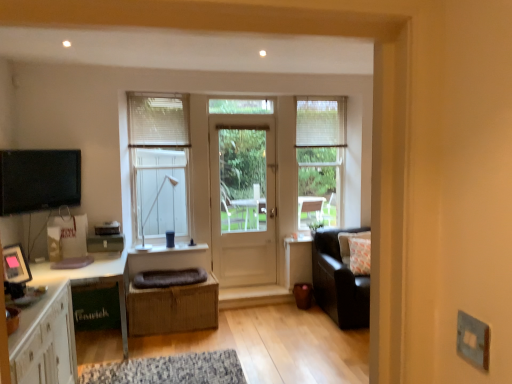
The width and height of the screenshot is (512, 384). I want to click on white textured blinds at upper right, acting as the first window starting from the right, so click(x=320, y=159).

The width and height of the screenshot is (512, 384). Describe the element at coordinates (173, 308) in the screenshot. I see `brown woven crate at center` at that location.

Describe the element at coordinates (152, 209) in the screenshot. I see `matte white lamp at upper center` at that location.

Identify the location of white wooden door at center. (243, 198).

Find the location of a particular element. clear glass door at center, arranged as the second window when viewed from the right is located at coordinates (241, 106).

In the image, is matte white lamp at upper center on the left side or the right side of white glossy cabinet at lower left?

Clearly, matte white lamp at upper center is on the right of white glossy cabinet at lower left in the image.

From the image's perspective, is matte white lamp at upper center located above white glossy cabinet at lower left?

Yes, from the image's perspective, matte white lamp at upper center is above white glossy cabinet at lower left.

Considering the sizes of objects matte white lamp at upper center and white glossy cabinet at lower left in the image provided, who is shorter, matte white lamp at upper center or white glossy cabinet at lower left?

matte white lamp at upper center.

Consider the image. Can we say matte white lamp at upper center lies outside white glossy cabinet at lower left?

matte white lamp at upper center lies outside white glossy cabinet at lower left's area.

Are white textured blinds at upper right, which is counted as the third window, starting from the left, and matte white lamp at upper center located far from each other?

That's right, there is a large distance between white textured blinds at upper right, which is counted as the third window, starting from the left, and matte white lamp at upper center.

Considering the positions of objects white textured blinds at upper right, acting as the first window starting from the right, and matte white lamp at upper center in the image provided, who is more to the left, white textured blinds at upper right, acting as the first window starting from the right, or matte white lamp at upper center?

From the viewer's perspective, matte white lamp at upper center appears more on the left side.

Is the depth of white textured blinds at upper right, which is counted as the third window, starting from the left, less than that of matte white lamp at upper center?

No.

From the image's perspective, between white textured blinds at upper right, acting as the first window starting from the right, and matte white lamp at upper center, who is located below?

matte white lamp at upper center.

Choose the correct answer: Is white fabric curtain at upper left, which appears as the first curtain when viewed from the front, inside matte white window at center left, acting as the 3th window starting from the right, or outside it?

white fabric curtain at upper left, which appears as the first curtain when viewed from the front, is inside matte white window at center left, acting as the 3th window starting from the right.

Is white fabric curtain at upper left, placed as the first curtain when sorted from left to right, oriented towards matte white window at center left, the 1th window viewed from the left?

Yes.

You are a GUI agent. You are given a task and a screenshot of the screen. Output one action in this format:
    pyautogui.click(x=<x>, y=<y>)
    Task: Click on the 1st curtain above when counting from the matte white window at center left, acting as the 3th window starting from the right (from the image's perspective)
    This screenshot has height=384, width=512.
    Given the screenshot: What is the action you would take?
    pyautogui.click(x=158, y=121)

Between white fabric curtain at upper left, the second curtain when ordered from back to front, and matte white window at center left, acting as the 3th window starting from the right, which one has smaller size?

With smaller size is white fabric curtain at upper left, the second curtain when ordered from back to front.

Is white fabric curtain at upper center, the 1th curtain viewed from the back, bigger than brown woven crate at center?

No, white fabric curtain at upper center, the 1th curtain viewed from the back, is not bigger than brown woven crate at center.

Can you confirm if white fabric curtain at upper center, the 1th curtain viewed from the back, is positioned to the right of brown woven crate at center?

Yes, white fabric curtain at upper center, the 1th curtain viewed from the back, is to the right of brown woven crate at center.

What's the angular difference between white fabric curtain at upper center, the 1th curtain viewed from the back, and brown woven crate at center's facing directions?

2.26 degrees.

Find the location of `crate in front of the white fabric curtain at upper center, which is the 2th curtain from front to back`. crate in front of the white fabric curtain at upper center, which is the 2th curtain from front to back is located at coordinates (173, 308).

Who is bigger, matte white window at center left, acting as the 3th window starting from the right, or white glossy cabinet at lower left?

→ white glossy cabinet at lower left is bigger.

Is matte white window at center left, acting as the 3th window starting from the right, not inside white glossy cabinet at lower left?

Absolutely, matte white window at center left, acting as the 3th window starting from the right, is external to white glossy cabinet at lower left.

From a real-world perspective, relative to white glossy cabinet at lower left, is matte white window at center left, acting as the 3th window starting from the right, vertically above or below?

In terms of real-world spatial position, matte white window at center left, acting as the 3th window starting from the right, is above white glossy cabinet at lower left.

From a real-world perspective, who is located higher, brown woven crate at center or white paper bag at left?

In real-world perspective, white paper bag at left is above.

Can you confirm if brown woven crate at center is taller than white paper bag at left?

→ No, brown woven crate at center is not taller than white paper bag at left.

Does brown woven crate at center have a lesser width compared to white paper bag at left?

In fact, brown woven crate at center might be wider than white paper bag at left.

Does brown woven crate at center lie in front of white paper bag at left?

Yes, the depth of brown woven crate at center is less than that of white paper bag at left.

Is white textured blinds at upper right, acting as the first window starting from the right, taller than brown woven crate at center?

Indeed, white textured blinds at upper right, acting as the first window starting from the right, has a greater height compared to brown woven crate at center.

Is white textured blinds at upper right, which is counted as the third window, starting from the left, located outside brown woven crate at center?

That's correct, white textured blinds at upper right, which is counted as the third window, starting from the left, is outside of brown woven crate at center.

From a real-world perspective, is white textured blinds at upper right, which is counted as the third window, starting from the left, on top of brown woven crate at center?

Yes, from a real-world perspective, white textured blinds at upper right, which is counted as the third window, starting from the left, is on top of brown woven crate at center.

The height and width of the screenshot is (384, 512). What are the coordinates of `lamp above the white glossy cabinet at lower left (from the image's perspective)` in the screenshot? It's located at (152, 209).

This screenshot has height=384, width=512. I want to click on lamp below the white textured blinds at upper right, which is counted as the third window, starting from the left (from the image's perspective), so click(152, 209).

In the scene shown: From the image, which object appears to be nearer to brown woven crate at center, matte white window at center left, acting as the 3th window starting from the right, or white textured blinds at upper right, which is counted as the third window, starting from the left?

Based on the image, matte white window at center left, acting as the 3th window starting from the right, appears to be nearer to brown woven crate at center.

Looking at the image, which one is located closer to matte black tv at left, white glossy desk at left or white textured blinds at upper right, which is counted as the third window, starting from the left?

Based on the image, white glossy desk at left appears to be nearer to matte black tv at left.

Estimate the real-world distances between objects in this image. Which object is closer to white textured blinds at upper right, which is counted as the third window, starting from the left, white glossy cabinet at lower left or matte white lamp at upper center?

matte white lamp at upper center.

Looking at the image, which one is located closer to white fabric curtain at upper left, arranged as the second curtain when viewed from the right, clear glass door at center, the 2th window from the left, or matte black tv at left?

Among the two, clear glass door at center, the 2th window from the left, is located nearer to white fabric curtain at upper left, arranged as the second curtain when viewed from the right.

From the image, which object appears to be farther from white glossy cabinet at lower left, clear glass door at center, arranged as the second window when viewed from the right, or matte white window at center left, the 1th window viewed from the left?

clear glass door at center, arranged as the second window when viewed from the right.

Estimate the real-world distances between objects in this image. Which object is closer to white textured blinds at upper right, acting as the first window starting from the right, matte white lamp at upper center or white wooden door at center?

white wooden door at center is positioned closer to the anchor white textured blinds at upper right, acting as the first window starting from the right.

Based on their spatial positions, is matte black tv at left or white wooden door at center closer to white glossy cabinet at lower left?

The object closer to white glossy cabinet at lower left is matte black tv at left.

From the image, which object appears to be nearer to matte white lamp at upper center, white textured blinds at upper right, acting as the first window starting from the right, or brown woven crate at center?

Based on the image, brown woven crate at center appears to be nearer to matte white lamp at upper center.

Image resolution: width=512 pixels, height=384 pixels. I want to click on desk between white fabric curtain at upper left, which appears as the first curtain when viewed from the front, and brown woven crate at center in the up-down direction, so click(x=96, y=280).

Image resolution: width=512 pixels, height=384 pixels. Identify the location of crate between matte black tv at left and white fabric curtain at upper center, positioned as the second curtain in left-to-right order, in the horizontal direction. (173, 308).

Image resolution: width=512 pixels, height=384 pixels. I want to click on lamp between matte black tv at left and white textured blinds at upper right, acting as the first window starting from the right, so click(152, 209).

Find the location of `door situated between white fabric curtain at upper left, arranged as the second curtain when viewed from the right, and white fabric curtain at upper center, the 1th curtain viewed from the back, from left to right`. door situated between white fabric curtain at upper left, arranged as the second curtain when viewed from the right, and white fabric curtain at upper center, the 1th curtain viewed from the back, from left to right is located at coordinates (243, 198).